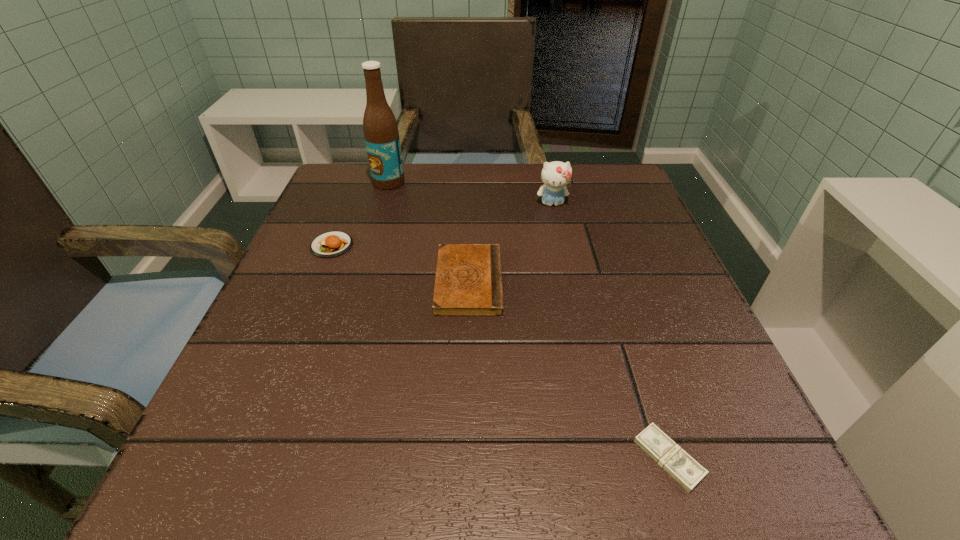
Find the location of `the tallest object`. the tallest object is located at coordinates (380, 128).

Locate an element on the screen. the farthest object is located at coordinates (380, 128).

The image size is (960, 540). Find the location of `the fourth object from left to right`. the fourth object from left to right is located at coordinates (555, 175).

Find the location of a particular element. kitten is located at coordinates (555, 175).

Locate an element on the screen. This screenshot has width=960, height=540. the third tallest object is located at coordinates (331, 244).

You are a GUI agent. You are given a task and a screenshot of the screen. Output one action in this format:
    pyautogui.click(x=<x>, y=<y>)
    Task: Click on the third object from left to right
    This screenshot has height=540, width=960.
    Given the screenshot: What is the action you would take?
    pyautogui.click(x=468, y=282)

I want to click on the fourth tallest object, so click(468, 282).

This screenshot has height=540, width=960. Identify the location of money. click(663, 450).

Image resolution: width=960 pixels, height=540 pixels. In order to click on the nearest object in this screenshot , I will do (663, 450).

You are a GUI agent. You are given a task and a screenshot of the screen. Output one action in this format:
    pyautogui.click(x=<x>, y=<y>)
    Task: Click on the vacant area situated on the left of the beer bottle
    Image resolution: width=960 pixels, height=540 pixels.
    Given the screenshot: What is the action you would take?
    pyautogui.click(x=352, y=183)